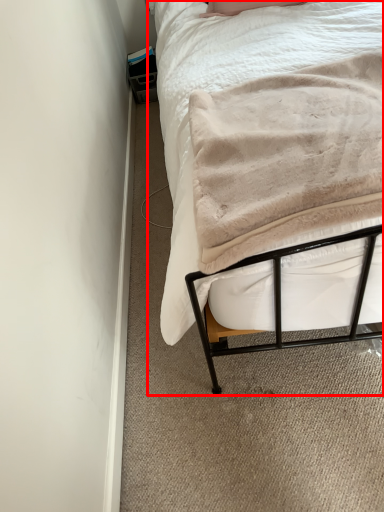
Question: In this image, where is bed (annotated by the red box) located relative to blanket?

Choices:
 (A) right
 (B) left

Answer: (B)